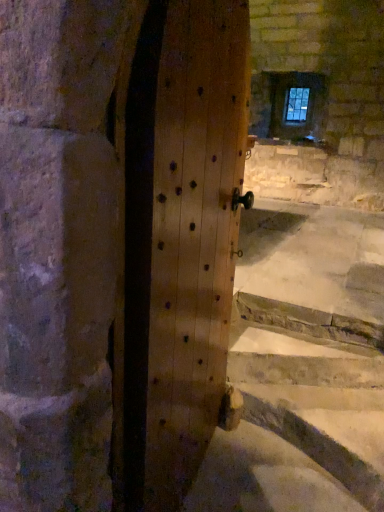
Question: Can you confirm if natural wood door at center is shorter than clear glass window at upper center?

Choices:
 (A) no
 (B) yes

Answer: (A)

Question: Can you confirm if natural wood door at center is positioned to the left of clear glass window at upper center?

Choices:
 (A) yes
 (B) no

Answer: (A)

Question: Is natural wood door at center oriented towards clear glass window at upper center?

Choices:
 (A) yes
 (B) no

Answer: (B)

Question: Does natural wood door at center have a greater width compared to clear glass window at upper center?

Choices:
 (A) no
 (B) yes

Answer: (B)

Question: Considering the relative positions of natural wood door at center and clear glass window at upper center in the image provided, is natural wood door at center behind clear glass window at upper center?

Choices:
 (A) no
 (B) yes

Answer: (A)

Question: From a real-world perspective, is natural wood door at center beneath clear glass window at upper center?

Choices:
 (A) yes
 (B) no

Answer: (A)

Question: Does clear glass window at upper center have a lesser width compared to natural wood door at center?

Choices:
 (A) no
 (B) yes

Answer: (B)

Question: Is clear glass window at upper center shorter than natural wood door at center?

Choices:
 (A) yes
 (B) no

Answer: (A)

Question: Is clear glass window at upper center turned away from natural wood door at center?

Choices:
 (A) no
 (B) yes

Answer: (A)

Question: Is clear glass window at upper center aimed at natural wood door at center?

Choices:
 (A) no
 (B) yes

Answer: (B)

Question: Is clear glass window at upper center outside natural wood door at center?

Choices:
 (A) yes
 (B) no

Answer: (A)

Question: Is clear glass window at upper center to the right of natural wood door at center from the viewer's perspective?

Choices:
 (A) no
 (B) yes

Answer: (B)

Question: Is natural wood door at center wider or thinner than clear glass window at upper center?

Choices:
 (A) wide
 (B) thin

Answer: (A)